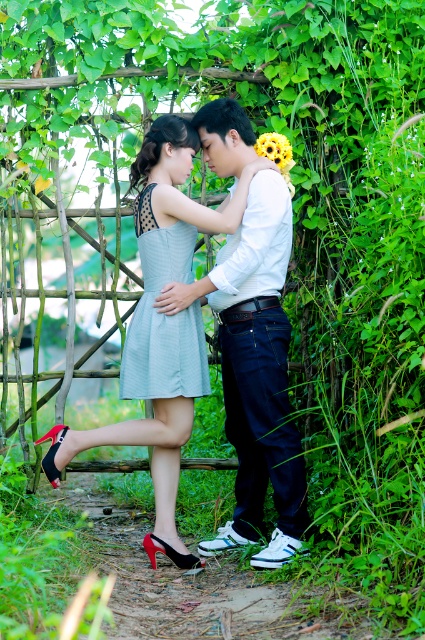
Who is higher up, matte gray dress at center or yellow matte flower at upper center?

Positioned higher is yellow matte flower at upper center.

Between matte gray dress at center and yellow matte flower at upper center, which one is positioned lower?

Positioned lower is matte gray dress at center.

Who is more distant from viewer, (132, 422) or (269, 154)?

Positioned behind is point (132, 422).

I want to click on matte gray dress at center, so click(161, 324).

Is white smooth shirt at center shorter than yellow matte flower at upper center?

In fact, white smooth shirt at center may be taller than yellow matte flower at upper center.

Does white smooth shirt at center have a greater height compared to yellow matte flower at upper center?

Correct, white smooth shirt at center is much taller as yellow matte flower at upper center.

What do you see at coordinates (257, 372) in the screenshot? The image size is (425, 640). I see `white smooth shirt at center` at bounding box center [257, 372].

Where is `white smooth shirt at center`? white smooth shirt at center is located at coordinates (257, 372).

Can you confirm if matte gray dress at center is taller than light blue fabric dress at center?

Yes.

Is matte gray dress at center in front of light blue fabric dress at center?

Yes, matte gray dress at center is in front of light blue fabric dress at center.

The width and height of the screenshot is (425, 640). Find the location of `matte gray dress at center`. matte gray dress at center is located at coordinates (161, 324).